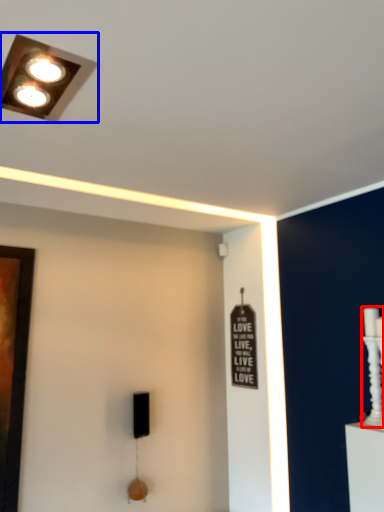
Question: Which object is closer to the camera taking this photo, candle holder (highlighted by a red box) or lamp (highlighted by a blue box)?

Choices:
 (A) candle holder
 (B) lamp

Answer: (B)